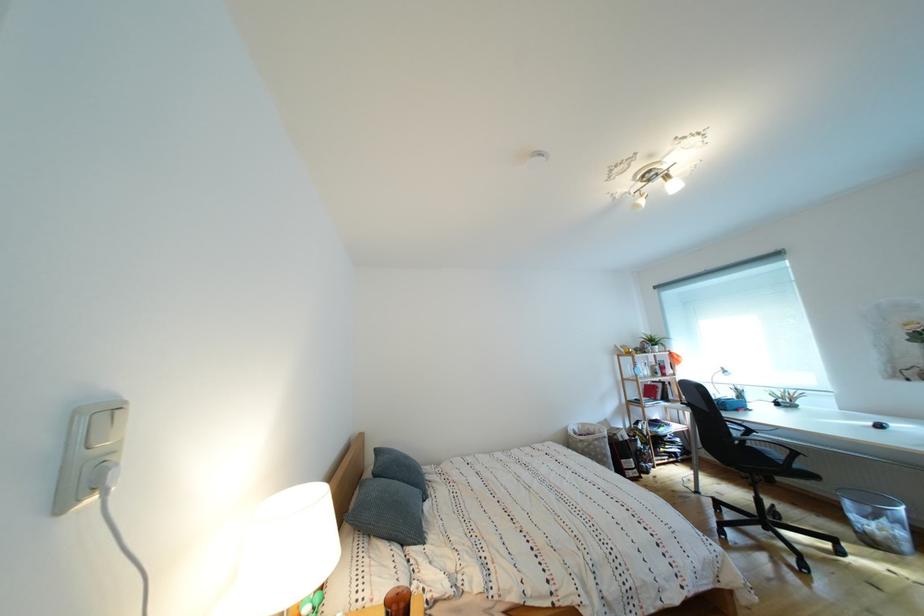
The image size is (924, 616). I want to click on white power plug, so click(x=98, y=477).